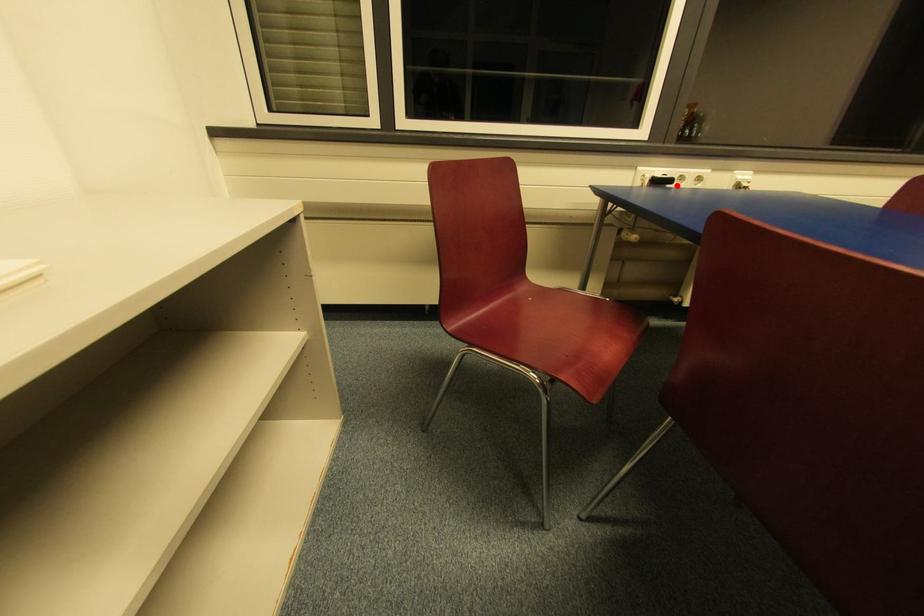
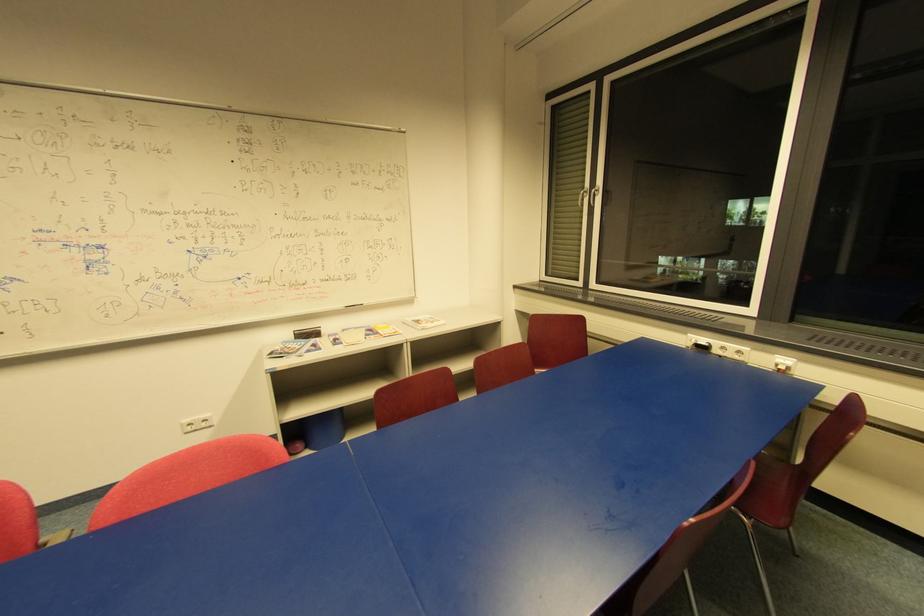
The point at the highlighted location is marked in the first image. Where is the corresponding point in the second image?

(720, 352)